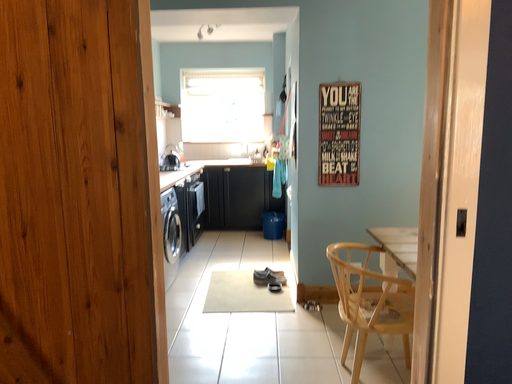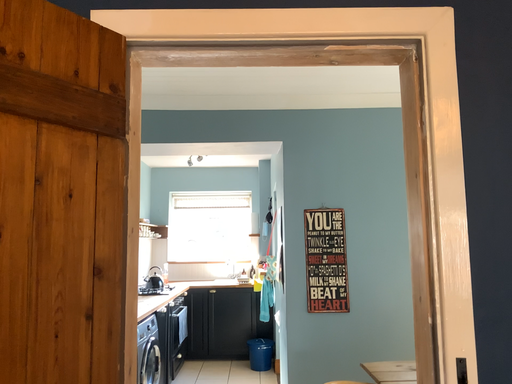
Question: Which way did the camera rotate in the video?

Choices:
 (A) rotated upward
 (B) rotated downward

Answer: (A)